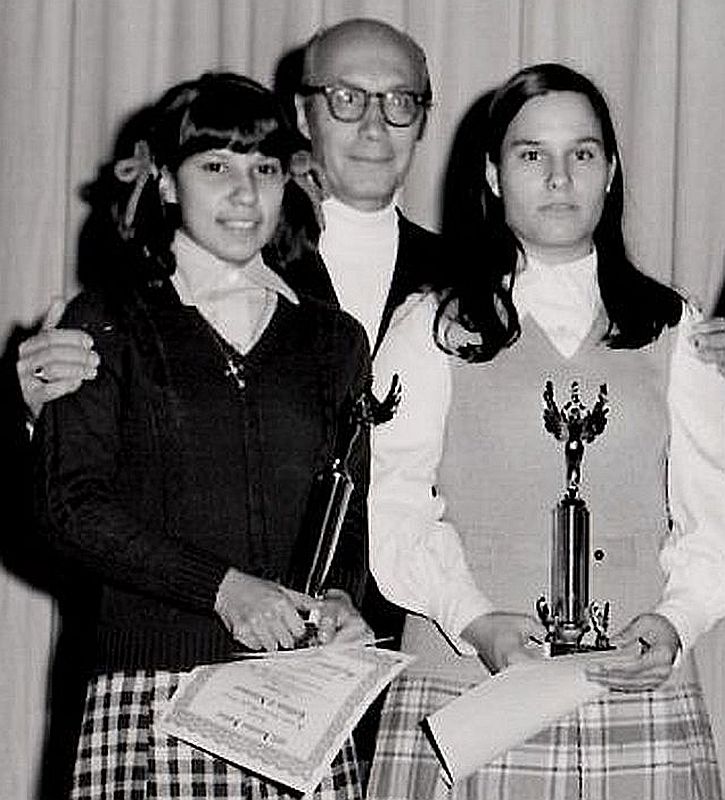
Image resolution: width=725 pixels, height=800 pixels. I want to click on curtains, so click(96, 80).